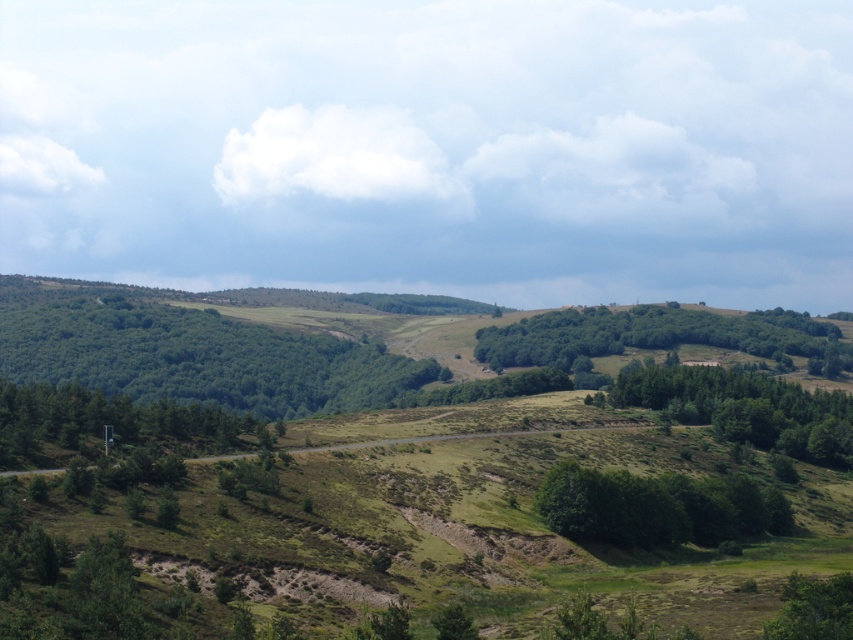
Can you confirm if green matte tree at center-left is wider than green leafy tree at lower center?

Correct, the width of green matte tree at center-left exceeds that of green leafy tree at lower center.

Is green matte tree at center-left smaller than green leafy tree at lower center?

Incorrect, green matte tree at center-left is not smaller in size than green leafy tree at lower center.

Is point (13, 412) farther from camera compared to point (463, 620)?

Yes, point (13, 412) is behind point (463, 620).

Identify the location of green matte tree at center-left. Image resolution: width=853 pixels, height=640 pixels. (109, 426).

Can you confirm if green leafy trees at left is positioned to the right of green matte tree at center-left?

In fact, green leafy trees at left is to the left of green matte tree at center-left.

Is point (422, 364) positioned in front of point (57, 412)?

No, (422, 364) is behind (57, 412).

Locate an element on the screen. Image resolution: width=853 pixels, height=640 pixels. green leafy trees at left is located at coordinates (199, 356).

Who is lower down, green leafy trees at left or green leafy tree at lower right?

green leafy tree at lower right is lower down.

Is point (254, 349) in front of point (799, 616)?

That is False.

Is point (25, 333) positioned before point (851, 586)?

No, (25, 333) is further to viewer.

The height and width of the screenshot is (640, 853). Identify the location of green leafy trees at left. (199, 356).